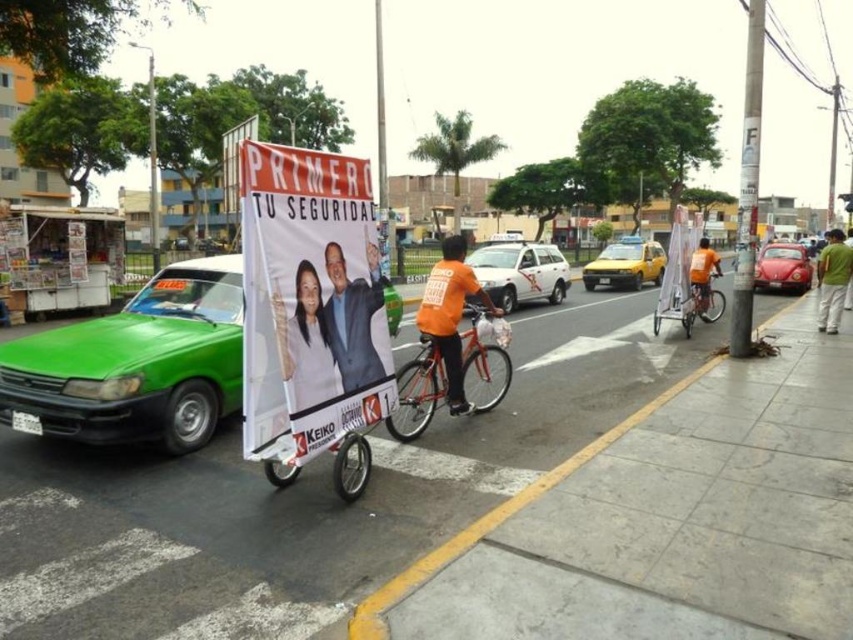
You are a pedestrian standing at the crosswalk on the street. You see a matte orange bicycle at center and a metallic red car at right. Which vehicle is closer to you?

The matte orange bicycle at center is closer to you because it is positioned at the center of the scene, while the metallic red car at right is further away.

You are a pedestrian standing at point (418, 392). What object is directly in front of you?

The matte orange bicycle at center is located at point (418, 392), so that is the object directly in front of you.

You are a pedestrian standing at the crosswalk. You see a matte orange bicycle at center and a metallic red car at right approaching. Which one will you need to avoid first?

The matte orange bicycle at center is thinner than metallic red car at right, so it will be easier to avoid. However, since both are approaching, you should prioritize avoiding the metallic red car at right first because it is wider and poses a greater risk if not avoided in time.